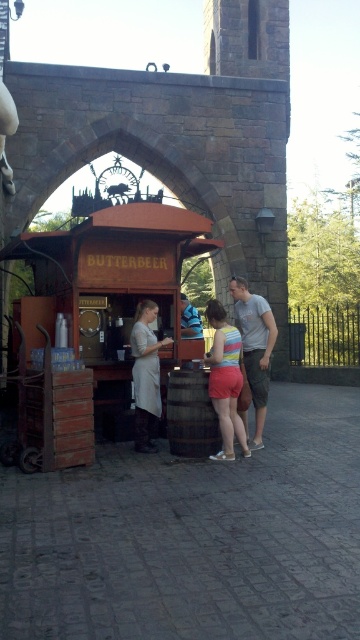
Question: Which object is positioned closest to the brown wooden barrel at lower center?

Choices:
 (A) striped fabric shorts at center
 (B) blue striped shirt at center
 (C) gray cotton t-shirt at center

Answer: (A)

Question: Is gray cotton t-shirt at center wider than brown wooden barrel at lower center?

Choices:
 (A) no
 (B) yes

Answer: (A)

Question: Where is brown wooden barrel at lower center located in relation to blue striped shirt at center in the image?

Choices:
 (A) above
 (B) below

Answer: (B)

Question: Which is nearer to the gray cotton t-shirt at center?

Choices:
 (A) brown wooden barrel at lower center
 (B) striped fabric shorts at center
 (C) white fabric apron at center

Answer: (B)

Question: Does striped fabric shorts at center appear over blue striped shirt at center?

Choices:
 (A) no
 (B) yes

Answer: (A)

Question: Among these objects, which one is farthest from the camera?

Choices:
 (A) striped fabric shorts at center
 (B) brown wooden barrel at lower center
 (C) blue striped shirt at center

Answer: (C)